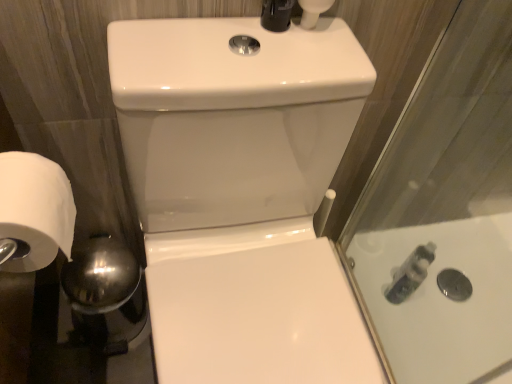
What do you see at coordinates (410, 273) in the screenshot? Image resolution: width=512 pixels, height=384 pixels. I see `translucent plastic bottle at right` at bounding box center [410, 273].

Locate an element on the screen. white glossy sink at center is located at coordinates (242, 194).

At what (x,y) coordinates should I click in order to perform the action: click on translucent plastic bottle at right. Please return your answer as a coordinate pair (x, y). The image size is (512, 384). Looking at the image, I should click on (410, 273).

Consider the image. From the image's perspective, would you say translucent plastic bottle at right is positioned over white matte toilet paper at left?

No, from the image's perspective, translucent plastic bottle at right is not on top of white matte toilet paper at left.

Does point (397, 287) come farther from viewer compared to point (41, 168)?

Yes, point (397, 287) is farther from viewer.

Which of these two, translucent plastic bottle at right or white matte toilet paper at left, is wider?

white matte toilet paper at left is wider.

From the image's perspective, which object appears higher, white glossy sink at center or white matte toilet paper at left?

white matte toilet paper at left.

Can you tell me how much white glossy sink at center and white matte toilet paper at left differ in facing direction?

90.9 degrees.

Between white glossy sink at center and white matte toilet paper at left, which one appears on the left side from the viewer's perspective?

Positioned to the left is white matte toilet paper at left.

Relative to white matte toilet paper at left, is white glossy sink at center in front or behind?

Visually, white glossy sink at center is located in front of white matte toilet paper at left.

Based on the photo, which is more to the right, white matte toilet paper at left or translucent plastic bottle at right?

translucent plastic bottle at right is more to the right.

Consider the image. From a real-world perspective, is white matte toilet paper at left on translucent plastic bottle at right?

Correct, in the physical world, white matte toilet paper at left is higher than translucent plastic bottle at right.

From the image's perspective, is white matte toilet paper at left above or below translucent plastic bottle at right?

white matte toilet paper at left is above translucent plastic bottle at right.

Is white matte toilet paper at left far from translucent plastic bottle at right?

Yes, white matte toilet paper at left is far from translucent plastic bottle at right.

Is translucent plastic bottle at right spatially inside white glossy sink at center, or outside of it?

translucent plastic bottle at right lies outside white glossy sink at center.

How different are the orientations of translucent plastic bottle at right and white glossy sink at center in degrees?

The angle between the facing direction of translucent plastic bottle at right and the facing direction of white glossy sink at center is 4.01 degrees.

How distant is translucent plastic bottle at right from white glossy sink at center?

26.83 inches.

Does translucent plastic bottle at right appear on the right side of white glossy sink at center?

Correct, you'll find translucent plastic bottle at right to the right of white glossy sink at center.

Is white glossy sink at center spatially inside translucent plastic bottle at right, or outside of it?

white glossy sink at center is not enclosed by translucent plastic bottle at right.

Can you confirm if white glossy sink at center is taller than translucent plastic bottle at right?

Yes.

Measure the distance between white glossy sink at center and translucent plastic bottle at right.

They are 26.83 inches apart.

Considering the positions of objects white glossy sink at center and translucent plastic bottle at right in the image provided, who is behind, white glossy sink at center or translucent plastic bottle at right?

translucent plastic bottle at right is further from the camera.

Does white matte toilet paper at left turn towards white glossy sink at center?

Yes, white matte toilet paper at left is turned towards white glossy sink at center.

Which is in front, white matte toilet paper at left or white glossy sink at center?

white glossy sink at center.

Which object is thinner, white matte toilet paper at left or white glossy sink at center?

white matte toilet paper at left.

Would you consider white matte toilet paper at left to be distant from white glossy sink at center?

They are positioned close to each other.

This screenshot has width=512, height=384. What are the coordinates of `toiletry below the white matte toilet paper at left (from the image's perspective)` in the screenshot? It's located at (410, 273).

Locate an element on the screen. Image resolution: width=512 pixels, height=384 pixels. toilet paper that appears on the left of white glossy sink at center is located at coordinates (35, 210).

When comparing their distances from white glossy sink at center, does white matte toilet paper at left or translucent plastic bottle at right seem further?

Based on the image, translucent plastic bottle at right appears to be further to white glossy sink at center.

When comparing their distances from white matte toilet paper at left, does white glossy sink at center or translucent plastic bottle at right seem closer?

Among the two, white glossy sink at center is located nearer to white matte toilet paper at left.

Which object lies nearer to the anchor point translucent plastic bottle at right, white matte toilet paper at left or white glossy sink at center?

white glossy sink at center.

When comparing their distances from white matte toilet paper at left, does translucent plastic bottle at right or white glossy sink at center seem further?

translucent plastic bottle at right is further to white matte toilet paper at left.

Looking at the image, which one is located further to white glossy sink at center, translucent plastic bottle at right or white matte toilet paper at left?

Among the two, translucent plastic bottle at right is located further to white glossy sink at center.

Considering their positions, is white glossy sink at center positioned further to translucent plastic bottle at right than white matte toilet paper at left?

Among the two, white matte toilet paper at left is located further to translucent plastic bottle at right.

You are a GUI agent. You are given a task and a screenshot of the screen. Output one action in this format:
    pyautogui.click(x=<x>, y=<y>)
    Task: Click on the toilet paper between white glossy sink at center and translucent plastic bottle at right in the front-back direction
    
    Given the screenshot: What is the action you would take?
    pyautogui.click(x=35, y=210)